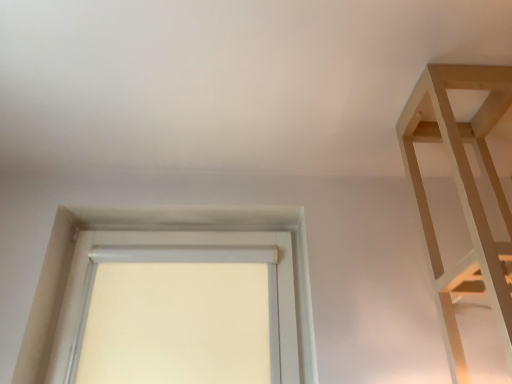
Question: From a real-world perspective, is white fabric window at center on light wood shelf at upper right?

Choices:
 (A) no
 (B) yes

Answer: (A)

Question: From a real-world perspective, is white fabric window at center beneath light wood shelf at upper right?

Choices:
 (A) yes
 (B) no

Answer: (A)

Question: Is light wood shelf at upper right inside white fabric window at center?

Choices:
 (A) no
 (B) yes

Answer: (A)

Question: Is there a large distance between white fabric window at center and light wood shelf at upper right?

Choices:
 (A) no
 (B) yes

Answer: (A)

Question: Is white fabric window at center wider than light wood shelf at upper right?

Choices:
 (A) yes
 (B) no

Answer: (B)

Question: Can you confirm if white fabric window at center is bigger than light wood shelf at upper right?

Choices:
 (A) yes
 (B) no

Answer: (B)

Question: Is light wood shelf at upper right positioned far away from white fabric window at center?

Choices:
 (A) yes
 (B) no

Answer: (B)

Question: Is light wood shelf at upper right outside white fabric window at center?

Choices:
 (A) yes
 (B) no

Answer: (A)

Question: Is light wood shelf at upper right next to white fabric window at center?

Choices:
 (A) no
 (B) yes

Answer: (A)

Question: Considering the relative positions of light wood shelf at upper right and white fabric window at center in the image provided, is light wood shelf at upper right to the right of white fabric window at center from the viewer's perspective?

Choices:
 (A) yes
 (B) no

Answer: (A)

Question: From a real-world perspective, is light wood shelf at upper right over white fabric window at center?

Choices:
 (A) yes
 (B) no

Answer: (A)

Question: From the image's perspective, is light wood shelf at upper right located beneath white fabric window at center?

Choices:
 (A) yes
 (B) no

Answer: (B)

Question: Is white fabric window at center situated inside light wood shelf at upper right or outside?

Choices:
 (A) inside
 (B) outside

Answer: (B)